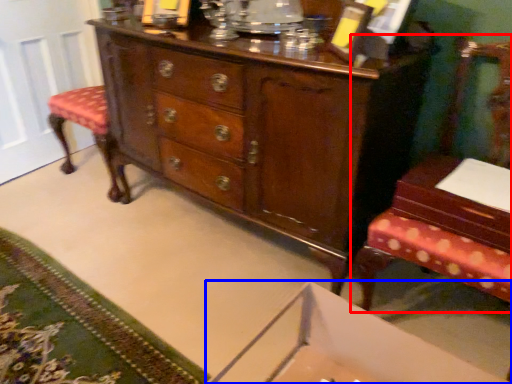
Question: Which object is closer to the camera taking this photo, furniture (highlighted by a red box) or changing table (highlighted by a blue box)?

Choices:
 (A) furniture
 (B) changing table

Answer: (B)